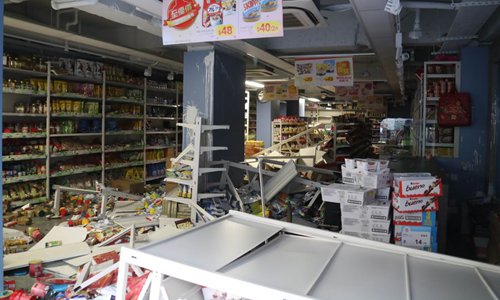
Identify the location of stack of boxesbig. This screenshot has width=500, height=300. (416, 188), (416, 202), (417, 223), (418, 231).